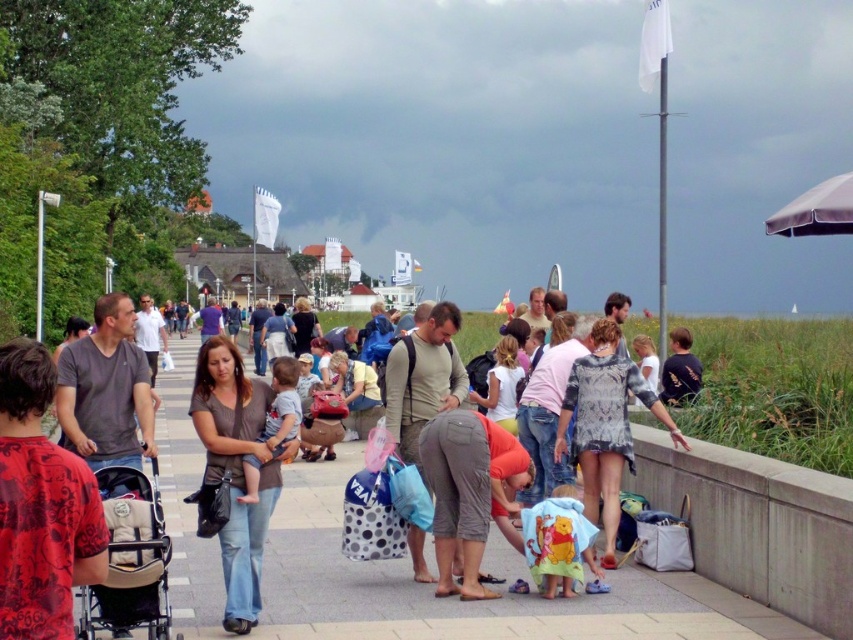
Which is below, matte brown shirt at center or beige fabric baby carriage at lower left?

beige fabric baby carriage at lower left is below.

Is point (212, 420) positioned behind point (117, 476)?

That is True.

The image size is (853, 640). I want to click on matte brown shirt at center, so click(x=236, y=468).

In the scene shown: Between red printed shirt at center and beige fabric baby carriage at lower left, which one has more height?

With more height is red printed shirt at center.

Is red printed shirt at center positioned in front of beige fabric baby carriage at lower left?

Yes, red printed shirt at center is in front of beige fabric baby carriage at lower left.

Who is more forward, (4, 499) or (109, 518)?

Point (4, 499) is more forward.

The image size is (853, 640). What are the coordinates of `red printed shirt at center` in the screenshot? It's located at (41, 506).

Is red printed shirt at center further to camera compared to matte brown shirt at center?

No, red printed shirt at center is in front of matte brown shirt at center.

This screenshot has height=640, width=853. Describe the element at coordinates (41, 506) in the screenshot. I see `red printed shirt at center` at that location.

I want to click on red printed shirt at center, so click(41, 506).